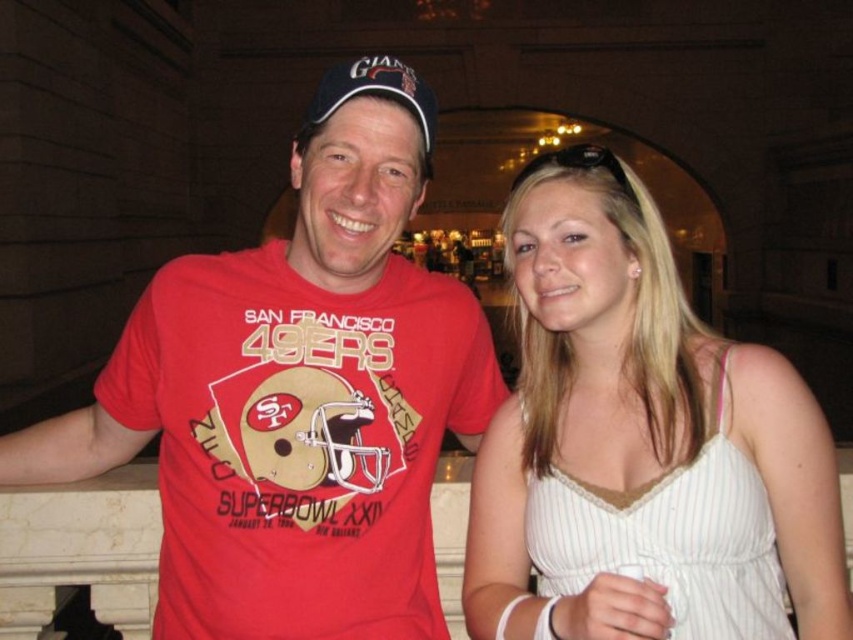
You are a photographer setting up for a group photo. You need to ensure that the white striped dress at center and the blue fabric baseball cap at center are both visible in the frame. Given their sizes, which item might require more careful positioning to avoid being obscured by other elements?

The white striped dress at center has a smaller width than the blue fabric baseball cap at center, so it might require more careful positioning to avoid being obscured by other elements due to its smaller size.